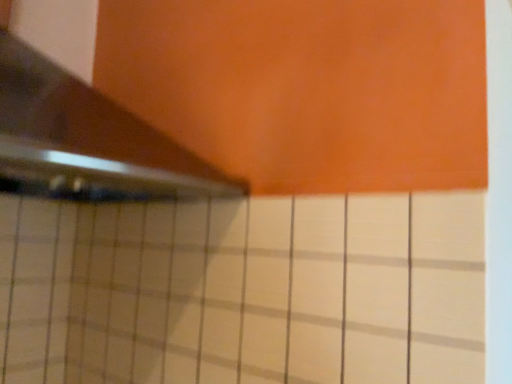
The image size is (512, 384). I want to click on satin silver exhaust hood at upper left, so click(88, 136).

Image resolution: width=512 pixels, height=384 pixels. What do you see at coordinates (88, 136) in the screenshot?
I see `satin silver exhaust hood at upper left` at bounding box center [88, 136].

Locate an element on the screen. satin silver exhaust hood at upper left is located at coordinates (88, 136).